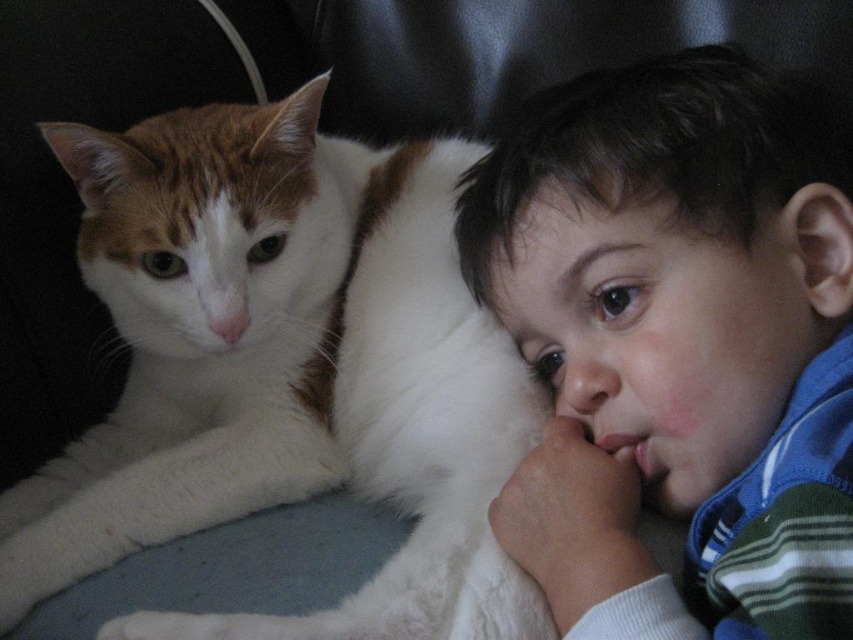
Consider the image. You are a photographer setting up for a portrait. You need to position a light source so that it illuminates both the white soft fur cat at left and the smooth blue striped shirt at right equally. Given their height difference, where should you place the light source relative to them?

The white soft fur cat at left is much taller than the smooth blue striped shirt at right. To ensure equal illumination, the light source should be placed higher above the white soft fur cat at left to compensate for its greater height, so both receive similar light intensity.

You are a robot navigating a room. You need to move from point A to point B. Point A is at coordinates point (285, 627) and point B is at coordinates point (641, 388). According to the scene, which point is closer to the camera?

Point (285, 627) is closer to the camera than point (641, 388) because it is in front of it.